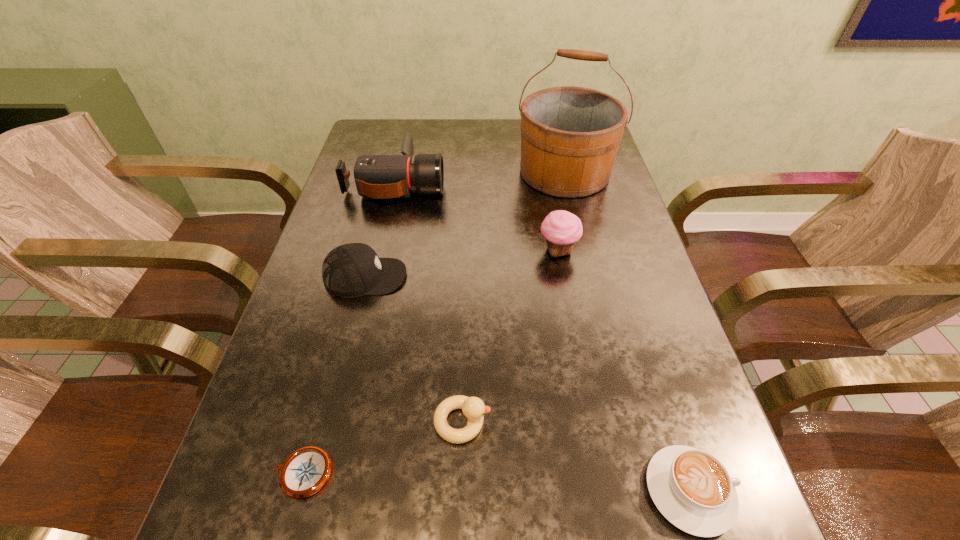
At what (x,y) coordinates should I click in order to perform the action: click on free point between the fifth farthest object and the cupcake. Please return your answer as a coordinate pair (x, y). Looking at the image, I should click on (510, 336).

Identify the location of free space that is in between the third nearest object and the camcorder. The image size is (960, 540). (429, 302).

Where is `empty space that is in between the shortest object and the tallest object`? empty space that is in between the shortest object and the tallest object is located at coordinates (434, 323).

Locate an element on the screen. This screenshot has width=960, height=540. vacant area between the fourth shortest object and the cupcake is located at coordinates (462, 264).

Identify the location of vacant area that lies between the shortest object and the cupcake. This screenshot has height=540, width=960. (430, 362).

Find the location of a particular element. object that is the fourth closest to the shortest object is located at coordinates (562, 229).

Locate an element on the screen. object that can be found as the sixth closest to the cappuccino is located at coordinates (376, 176).

At what (x,y) coordinates should I click in order to perform the action: click on vacant area that satisfies the following two spatial constraints: 1. on the front side of the cupcake; 2. at the beak of the duckling. Please return your answer as a coordinate pair (x, y). Looking at the image, I should click on (588, 422).

Identify the location of vacant space that satisfies the following two spatial constraints: 1. on the back side of the cupcake; 2. on the right side of the compass. (363, 251).

You are a GUI agent. You are given a task and a screenshot of the screen. Output one action in this format:
    pyautogui.click(x=<x>, y=<y>)
    Task: Click on the vacant area that satisfies the following two spatial constraints: 1. on the lens of the cupcake; 2. on the right side of the camcorder
    Image resolution: width=960 pixels, height=540 pixels.
    Given the screenshot: What is the action you would take?
    pyautogui.click(x=380, y=251)